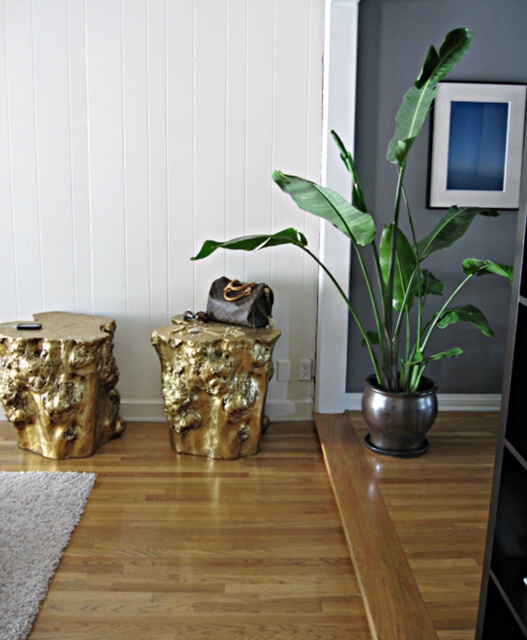
You are arranging a small plant that requires a sturdy base. You have two options in the scene, the gold textured stump at left and the metallic silver picture frame at upper right. Which object is more suitable for placing the plant?

The gold textured stump at left is more suitable for placing the plant because it has a larger size compared to the metallic silver picture frame at upper right, providing a sturdier base.

You are an interior designer arranging a space. You need to ensure that the green leafy plant at upper right and the gold textured stump at left are visible from the entrance. Given their heights, which object might block the view of the other when placed in front of it?

The green leafy plant at upper right is taller than the gold textured stump at left. If placed in front of the stump, the plant would block its view. Conversely, placing the stump in front of the plant would not obstruct the plant since the stump is shorter.